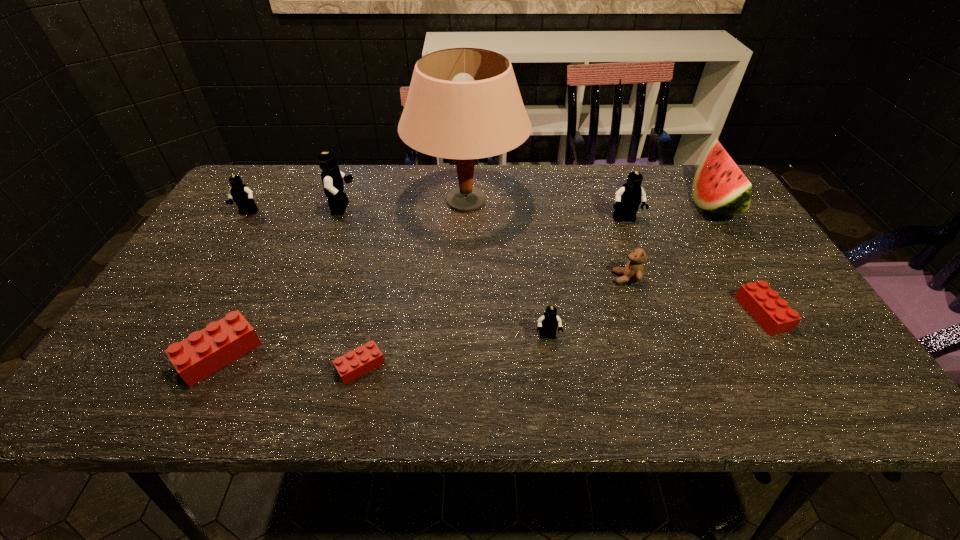
Select which black Lego appears as the second closest to the biggest black Lego. Please provide its 2D coordinates. Your answer should be formatted as a tuple, i.e. [(x, y)], where the tuple contains the x and y coordinates of a point satisfying the conditions above.

[(548, 323)]

Where is `red Lego that is the third closest to the tallest object`? The width and height of the screenshot is (960, 540). red Lego that is the third closest to the tallest object is located at coordinates (772, 313).

Identify which red Lego is the nearest to the third smallest black Lego. Please provide its 2D coordinates. Your answer should be formatted as a tuple, i.e. [(x, y)], where the tuple contains the x and y coordinates of a point satisfying the conditions above.

[(772, 313)]

Locate an element on the screen. The height and width of the screenshot is (540, 960). blank area in the image that satisfies the following two spatial constraints: 1. on the front-facing side of the second biggest black Lego; 2. on the right side of the sixth tallest Lego is located at coordinates pyautogui.click(x=660, y=313).

Image resolution: width=960 pixels, height=540 pixels. In order to click on vacant space that satisfies the following two spatial constraints: 1. on the front-facing side of the tallest object; 2. on the front-facing side of the fifth tallest object in this screenshot , I will do `click(467, 213)`.

You are a GUI agent. You are given a task and a screenshot of the screen. Output one action in this format:
    pyautogui.click(x=<x>, y=<y>)
    Task: Click on the vacant area in the image that satisfies the following two spatial constraints: 1. on the front-facing side of the rightmost red Lego; 2. on the left side of the brown teddy bear
    The height and width of the screenshot is (540, 960).
    Given the screenshot: What is the action you would take?
    pyautogui.click(x=637, y=313)

Locate an element on the screen. free point that satisfies the following two spatial constraints: 1. on the front-facing side of the sixth tallest Lego; 2. on the right side of the rightmost black Lego is located at coordinates (660, 313).